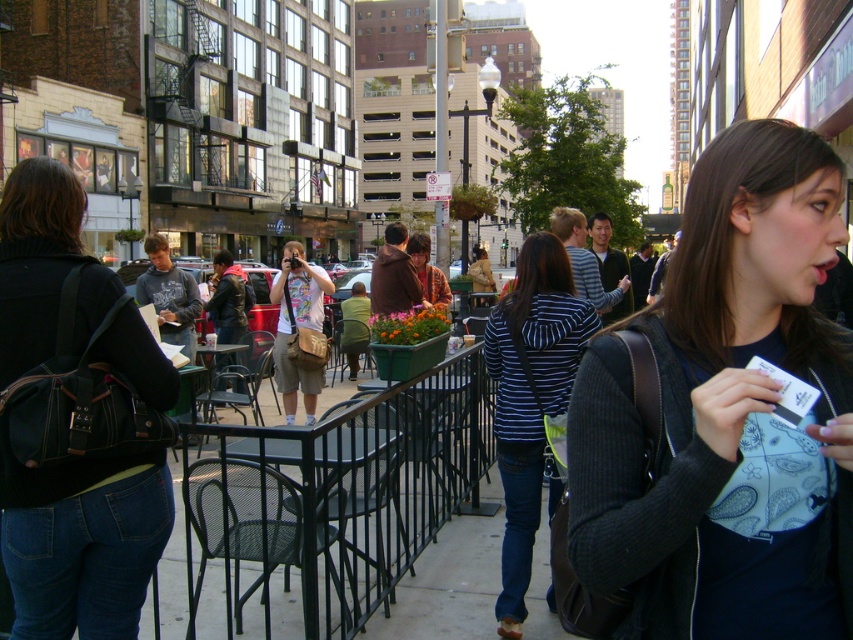
You are a tailor who needs to determine which item has a smaller width between the dark gray sweater at center and the leather jacket at center. Which one would you choose?

The dark gray sweater at center is thinner than the leather jacket at center, so the dark gray sweater at center has a smaller width.

You are a photographer standing at the edge of the sidewalk. You want to take a photo of the striped fabric jacket at center without including the denim jeans at lower left in the frame. Is this possible given their positions?

The denim jeans at lower left is positioned over striped fabric jacket at center, meaning the denim jeans is in front of the jacket. Therefore, it would be difficult to capture the jacket without the jeans blocking part of the view unless you move to an angle where the jeans are out of sight.

You are standing at the entrance of the sidewalk cafe and want to greet both the person wearing the dark gray sweater at center and the person wearing the leather jacket at center. Which one should you approach first if you want to minimize the distance walked?

The dark gray sweater at center is 24.61 feet away from the leather jacket at center. Since both are at the center, you can approach either one first as the distance between them is the same.